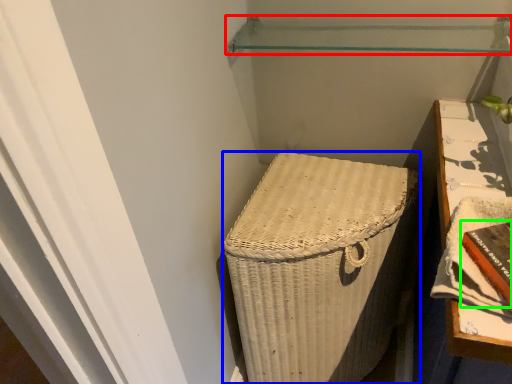
Question: Based on their relative distances, which object is nearer to shelf (highlighted by a red box)? Choose from furniture (highlighted by a blue box) and book (highlighted by a green box).

Choices:
 (A) furniture
 (B) book

Answer: (A)